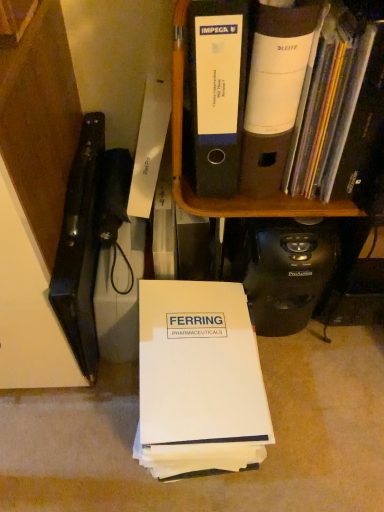
You are a GUI agent. You are given a task and a screenshot of the screen. Output one action in this format:
    pyautogui.click(x=<x>, y=<y>)
    Task: Click on the white matte folder at upper right, which ranks as the first book in right-to-left order
    
    Given the screenshot: What is the action you would take?
    pyautogui.click(x=340, y=110)

Measure the distance between black plastic file folders at upper center and camera.

black plastic file folders at upper center is 19.74 inches away from camera.

What is the approximate height of black plastic file folders at upper center?

12.77 inches.

This screenshot has height=512, width=384. Identify the location of white matte folder at upper right, which ranks as the first book in right-to-left order. (340, 110).

Is white paper at center, which ranks as the 1th book in left-to-right order, far from white matte folder at upper right, which ranks as the first book in right-to-left order?

They are positioned close to each other.

Which of these two, white paper at center, the second book in the right-to-left sequence, or white matte folder at upper right, positioned as the first book in top-to-bottom order, is bigger?

Bigger between the two is white paper at center, the second book in the right-to-left sequence.

Is white paper at center, the second book in the right-to-left sequence, positioned with its back to white matte folder at upper right, which ranks as the first book in right-to-left order?

No, white matte folder at upper right, which ranks as the first book in right-to-left order, is not at the back of white paper at center, the second book in the right-to-left sequence.

In order to click on book above the white paper at center, the second book in the right-to-left sequence (from the image's perspective) in this screenshot , I will do `click(340, 110)`.

From the picture: Is white paper at center, the second book in the right-to-left sequence, at the left side of black plastic file folders at upper center?

Indeed, white paper at center, the second book in the right-to-left sequence, is positioned on the left side of black plastic file folders at upper center.

Is white paper at center, the second book in the right-to-left sequence, shorter than black plastic file folders at upper center?

Indeed, white paper at center, the second book in the right-to-left sequence, has a lesser height compared to black plastic file folders at upper center.

Between white paper at center, the second book in the right-to-left sequence, and black plastic file folders at upper center, which one has smaller width?

With smaller width is black plastic file folders at upper center.

From the picture: Between white paper at center, which appears as the 1th book when ordered from the bottom, and black plastic file folders at upper center, which one is positioned in front?

Positioned in front is black plastic file folders at upper center.

From the picture: Which object is closer to the camera, black plastic file folders at upper center or white paper at center, which appears as the 1th book when ordered from the bottom?

black plastic file folders at upper center is closer to the camera.

Does black plastic file folders at upper center touch white paper at center, which appears as the 2th book when viewed from the top?

black plastic file folders at upper center and white paper at center, which appears as the 2th book when viewed from the top, are clearly separated.

Could you tell me if black plastic file folders at upper center is facing white paper at center, which appears as the 2th book when viewed from the top?

No, black plastic file folders at upper center is not facing towards white paper at center, which appears as the 2th book when viewed from the top.

Consider the image. Considering the sizes of black plastic file folders at upper center and white paper at center, which appears as the 2th book when viewed from the top, in the image, is black plastic file folders at upper center taller or shorter than white paper at center, which appears as the 2th book when viewed from the top,?

In the image, black plastic file folders at upper center appears to be taller than white paper at center, which appears as the 2th book when viewed from the top.

Looking at this image, in terms of height, does black plastic file folders at upper center look taller or shorter compared to white matte folder at upper right, positioned as the first book in top-to-bottom order?

Clearly, black plastic file folders at upper center is taller compared to white matte folder at upper right, positioned as the first book in top-to-bottom order.

Between black plastic file folders at upper center and white matte folder at upper right, the second book ordered from the bottom, which one has smaller size?

white matte folder at upper right, the second book ordered from the bottom, is smaller.

Could you tell me if black plastic file folders at upper center is turned towards white matte folder at upper right, the second book positioned from the left?

No, black plastic file folders at upper center is not turned towards white matte folder at upper right, the second book positioned from the left.

Locate an element on the screen. Image resolution: width=384 pixels, height=512 pixels. book in front of the black plastic file folders at upper center is located at coordinates (340, 110).

From the image's perspective, who appears lower, white matte folder at upper right, positioned as the first book in top-to-bottom order, or black plastic file folders at upper center?

From the image's view, white matte folder at upper right, positioned as the first book in top-to-bottom order, is below.

In the image, is white matte folder at upper right, the second book ordered from the bottom, positioned in front of or behind black plastic file folders at upper center?

white matte folder at upper right, the second book ordered from the bottom, is positioned closer to the viewer than black plastic file folders at upper center.

Between point (326, 187) and point (238, 216), which one is positioned behind?

The point (238, 216) is behind.

Can we say white matte folder at upper right, positioned as the first book in top-to-bottom order, lies outside white paper at center, which ranks as the 1th book in left-to-right order?

Absolutely, white matte folder at upper right, positioned as the first book in top-to-bottom order, is external to white paper at center, which ranks as the 1th book in left-to-right order.

Is white matte folder at upper right, the second book positioned from the left, positioned behind white paper at center, which appears as the 2th book when viewed from the top?

No, the depth of white matte folder at upper right, the second book positioned from the left, is less than that of white paper at center, which appears as the 2th book when viewed from the top.

Could you measure the distance between white matte folder at upper right, positioned as the first book in top-to-bottom order, and white paper at center, which ranks as the 1th book in left-to-right order?

white matte folder at upper right, positioned as the first book in top-to-bottom order, is 15.68 inches from white paper at center, which ranks as the 1th book in left-to-right order.

How different are the orientations of white matte folder at upper right, the second book positioned from the left, and white paper at center, which ranks as the 1th book in left-to-right order, in degrees?

The facing directions of white matte folder at upper right, the second book positioned from the left, and white paper at center, which ranks as the 1th book in left-to-right order, are 0.0713 degrees apart.

Locate an element on the screen. This screenshot has width=384, height=512. book below the white matte folder at upper right, positioned as the first book in top-to-bottom order (from the image's perspective) is located at coordinates (198, 380).

The height and width of the screenshot is (512, 384). In order to click on bookcase on the right of white paper at center, the second book in the right-to-left sequence in this screenshot , I will do `click(235, 196)`.

From the image, which object appears to be farther from white matte folder at upper right, the second book positioned from the left, black plastic file folders at upper center or white paper at center, the second book in the right-to-left sequence?

white paper at center, the second book in the right-to-left sequence, is further to white matte folder at upper right, the second book positioned from the left.

Looking at the image, which one is located closer to white paper at center, which ranks as the 1th book in left-to-right order, white matte folder at upper right, the second book ordered from the bottom, or black plastic file folders at upper center?

black plastic file folders at upper center lies closer to white paper at center, which ranks as the 1th book in left-to-right order, than the other object.

Looking at the image, which one is located closer to black plastic file folders at upper center, white paper at center, which appears as the 2th book when viewed from the top, or white matte folder at upper right, which ranks as the first book in right-to-left order?

white matte folder at upper right, which ranks as the first book in right-to-left order, lies closer to black plastic file folders at upper center than the other object.

Based on their spatial positions, is black plastic file folders at upper center or white matte folder at upper right, which ranks as the first book in right-to-left order, further from white paper at center, which appears as the 2th book when viewed from the top?

white matte folder at upper right, which ranks as the first book in right-to-left order.

Which object lies nearer to the anchor point black plastic file folders at upper center, white matte folder at upper right, the second book ordered from the bottom, or white paper at center, which appears as the 2th book when viewed from the top?

white matte folder at upper right, the second book ordered from the bottom, is positioned closer to the anchor black plastic file folders at upper center.

Considering their positions, is white paper at center, which ranks as the 1th book in left-to-right order, positioned further to white matte folder at upper right, the second book ordered from the bottom, than black plastic file folders at upper center?

white paper at center, which ranks as the 1th book in left-to-right order, lies further to white matte folder at upper right, the second book ordered from the bottom, than the other object.

Where is `book between black plastic file folders at upper center and white paper at center, which ranks as the 1th book in left-to-right order, in the vertical direction`? The width and height of the screenshot is (384, 512). book between black plastic file folders at upper center and white paper at center, which ranks as the 1th book in left-to-right order, in the vertical direction is located at coordinates (340, 110).